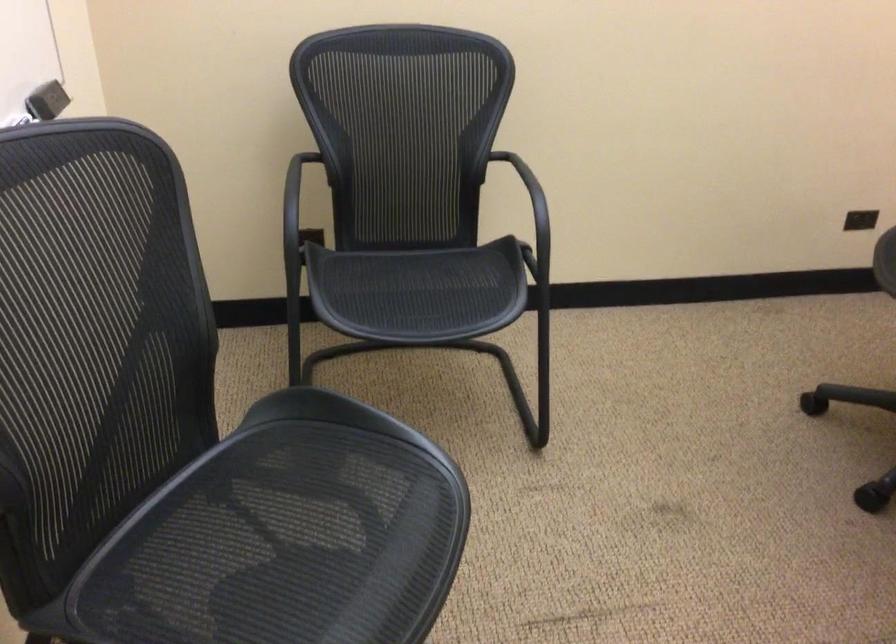
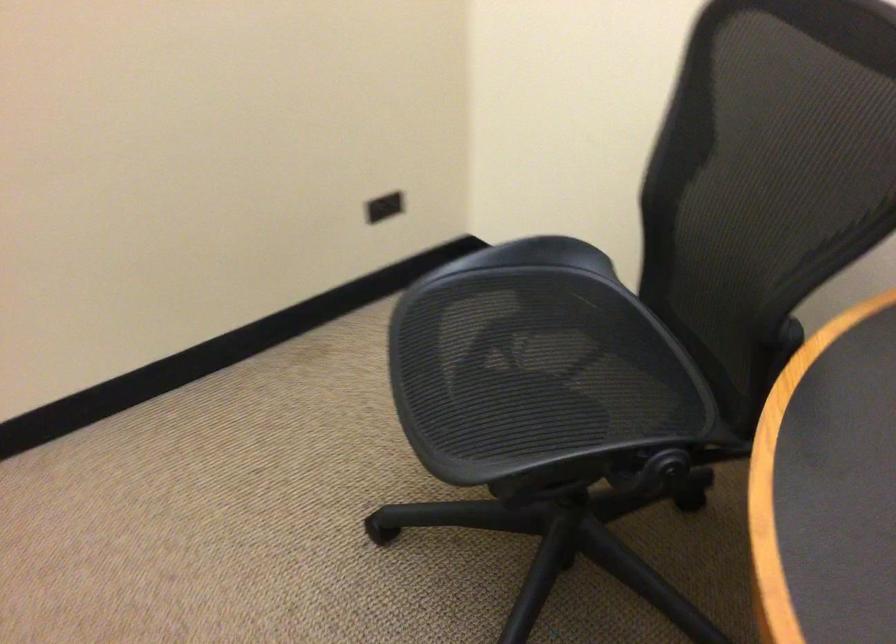
Question: The first image is from the beginning of the video and the second image is from the end. How did the camera likely rotate when shooting the video?

Choices:
 (A) Left
 (B) Right
 (C) Up
 (D) Down

Answer: (B)